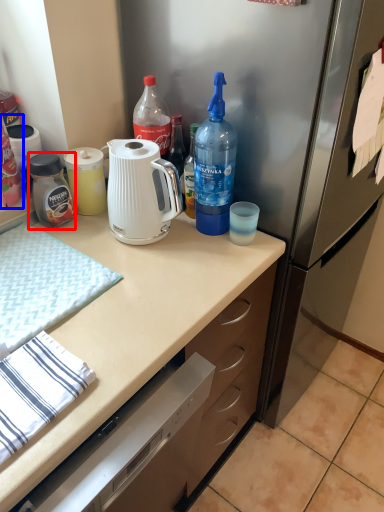
Question: Among these objects, which one is farthest to the camera, bottle (highlighted by a red box) or bottle (highlighted by a blue box)?

Choices:
 (A) bottle
 (B) bottle

Answer: (A)